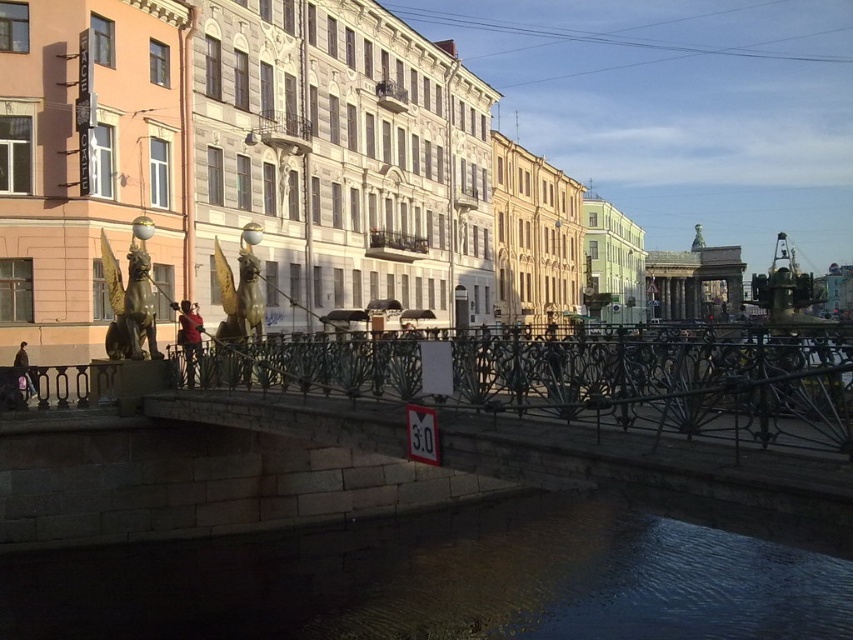
You are a tourist standing on the bridge and want to take a photo of the dark stone water at lower center and the black wrought iron fence at center. Which object should you focus on if you want to capture the larger subject in your photo?

The dark stone water at lower center is larger than the black wrought iron fence at center, so you should focus on the dark stone water at lower center to capture the larger subject in your photo.

You are standing at the base of the pedestrian bridge in the image and want to reach a point marked at coordinates point (x=491, y=589). If your average walking speed is 1.5 meters per second, approximately how many seconds will it take you to reach that point?

The distance of point (x=491, y=589) from viewer is 21.30 meters. At a walking speed of 1.5 meters per second, it would take approximately 14.2 seconds to reach the point.

You are a delivery person trying to cross the bridge to deliver a package to the cafe. The bridge has a narrow path between the dark stone water at lower center and the black wrought iron fence at center. Can you safely pass through this path if your delivery cart is 1.2 meters wide?

The dark stone water at lower center might be wider than the black wrought iron fence at center, but the exact width isn t specified. Without knowing the exact width of the path, it s uncertain if the 1.2 meter wide delivery cart can safely pass through.